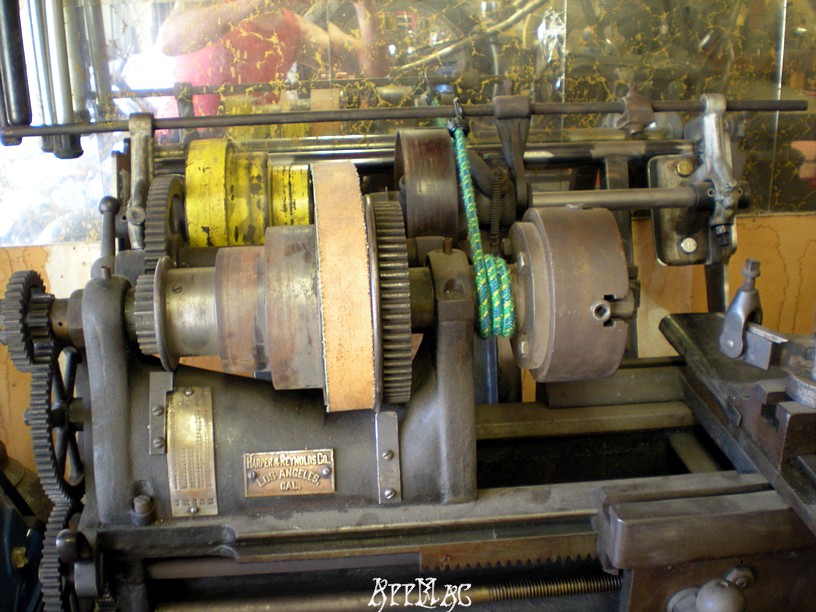
At what (x,y) coordinates should I click in order to perform the action: click on wall. Please return your answer as a coordinate pair (x, y). Looking at the image, I should click on tap(67, 259), tap(787, 262).